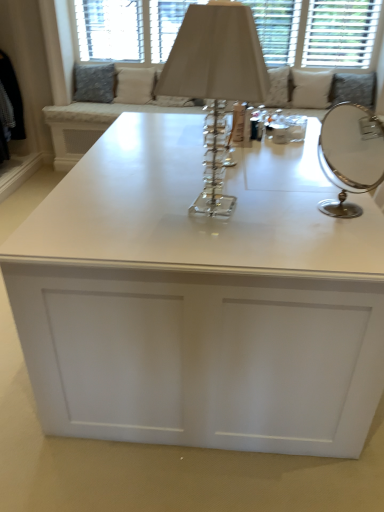
Question: Does white fabric pillow at upper right, which appears as the 3th pillow when viewed from the left, have a smaller size compared to white fabric cushion at upper center?

Choices:
 (A) no
 (B) yes

Answer: (B)

Question: From a real-world perspective, is white fabric pillow at upper right, which appears as the 3th pillow when viewed from the left, positioned under white fabric cushion at upper center based on gravity?

Choices:
 (A) no
 (B) yes

Answer: (B)

Question: Considering the relative sizes of white fabric pillow at upper right, acting as the 1th pillow starting from the right, and white fabric cushion at upper center in the image provided, is white fabric pillow at upper right, acting as the 1th pillow starting from the right, wider than white fabric cushion at upper center?

Choices:
 (A) yes
 (B) no

Answer: (A)

Question: Is white fabric pillow at upper right, acting as the 1th pillow starting from the right, taller than white fabric cushion at upper center?

Choices:
 (A) yes
 (B) no

Answer: (B)

Question: From a real-world perspective, is white fabric pillow at upper right, which appears as the 3th pillow when viewed from the left, above or below silver/metallic round mirror at right?

Choices:
 (A) above
 (B) below

Answer: (B)

Question: Is white fabric pillow at upper right, which appears as the 3th pillow when viewed from the left, taller or shorter than silver/metallic round mirror at right?

Choices:
 (A) short
 (B) tall

Answer: (B)

Question: Which is correct: white fabric pillow at upper right, acting as the 1th pillow starting from the right, is inside silver/metallic round mirror at right, or outside of it?

Choices:
 (A) inside
 (B) outside

Answer: (B)

Question: From the image's perspective, relative to silver/metallic round mirror at right, is white fabric pillow at upper right, acting as the 1th pillow starting from the right, above or below?

Choices:
 (A) above
 (B) below

Answer: (A)

Question: From the image's perspective, is beige fabric pillow at upper center, positioned as the 2th pillow in right-to-left order, above or below white fabric cushion at upper center?

Choices:
 (A) below
 (B) above

Answer: (A)

Question: Would you say beige fabric pillow at upper center, positioned as the 2th pillow in right-to-left order, is to the left or to the right of white fabric cushion at upper center in the picture?

Choices:
 (A) left
 (B) right

Answer: (A)

Question: Relative to white fabric cushion at upper center, is beige fabric pillow at upper center, positioned as the 2th pillow in right-to-left order, in front or behind?

Choices:
 (A) front
 (B) behind

Answer: (B)

Question: Is beige fabric pillow at upper center, positioned as the 2th pillow in right-to-left order, wider or thinner than white fabric cushion at upper center?

Choices:
 (A) thin
 (B) wide

Answer: (B)

Question: From a real-world perspective, is white glossy table at center physically located above or below clear crystal table lamp at center?

Choices:
 (A) below
 (B) above

Answer: (A)

Question: Is white glossy table at center wider or thinner than clear crystal table lamp at center?

Choices:
 (A) thin
 (B) wide

Answer: (B)